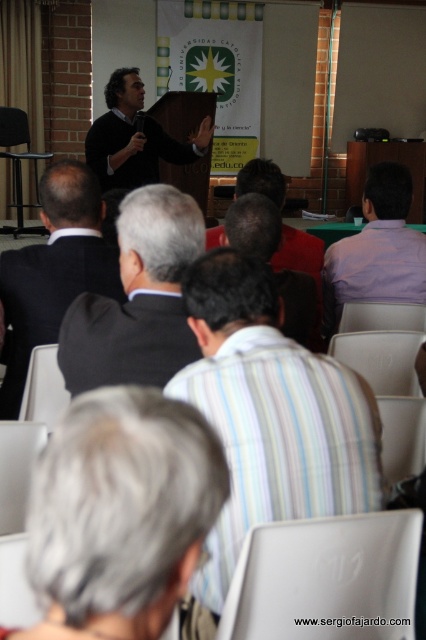
You are standing in the audience facing the podium. There are two points marked in the scene. The first point is at coordinates point (14, 323) and the second is at point (285, 253). Which point is closer to you?

Point (14, 323) is closer to the viewer than point (285, 253).

You are an event organizer who needs to arrange a microphone stand between the dark gray sweater at center and the red shirt at center. The stand requires at least 5 feet of space between the two people to be placed safely. Can you place the microphone stand between them?

The dark gray sweater at center and red shirt at center are 6.62 feet apart, so yes, the microphone stand can be placed between them since the distance is more than the required 5 feet.

You are attending a lecture at Universidad Catolica de Oriente and notice a point marked at coordinates (135, 138) in the image. What object is located at that point?

The point at (135, 138) corresponds to the dark gray sweater at center.